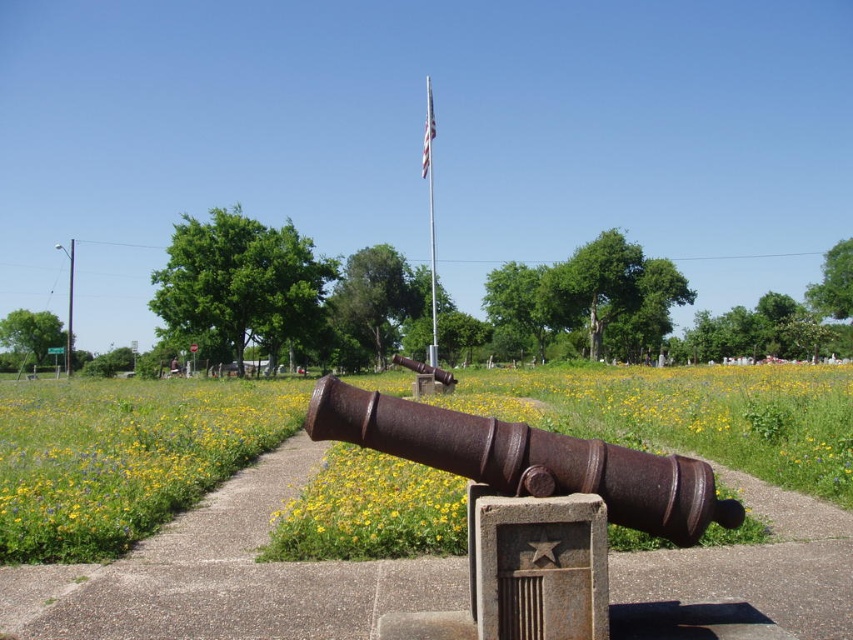
You are standing at the center of the paved pathway in the image. You want to place a new commemorative plaque at the exact location where the rusty metal cannon at center is currently positioned. What are the coordinates where you should place the plaque?

The coordinates for the rusty metal cannon at center are at point (x=531, y=499), so you should place the plaque at those coordinates.

Looking at this image, you are standing at the stop sign on the left side of the path and want to take a photo of the cannon. Which of the two points, point (434, 360) or point (65, 372), is closer to your current position?

Point (434, 360) is closer to the camera, so it is closer to your current position at the stop sign on the left side of the path.

You are standing at the paved pathway and see the rusty metal cannon at center and the silver metallic flag pole at center. Which object is closer to the ground?

The rusty metal cannon at center is closer to the ground because it is below the silver metallic flag pole at center.